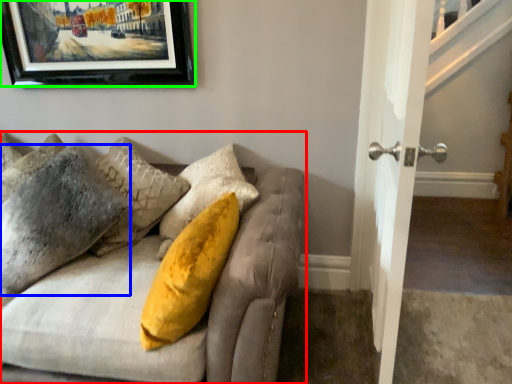
Question: Considering the real-world distances, which object is farthest from studio couch (highlighted by a red box)? pillow (highlighted by a blue box) or picture frame (highlighted by a green box)?

Choices:
 (A) pillow
 (B) picture frame

Answer: (B)